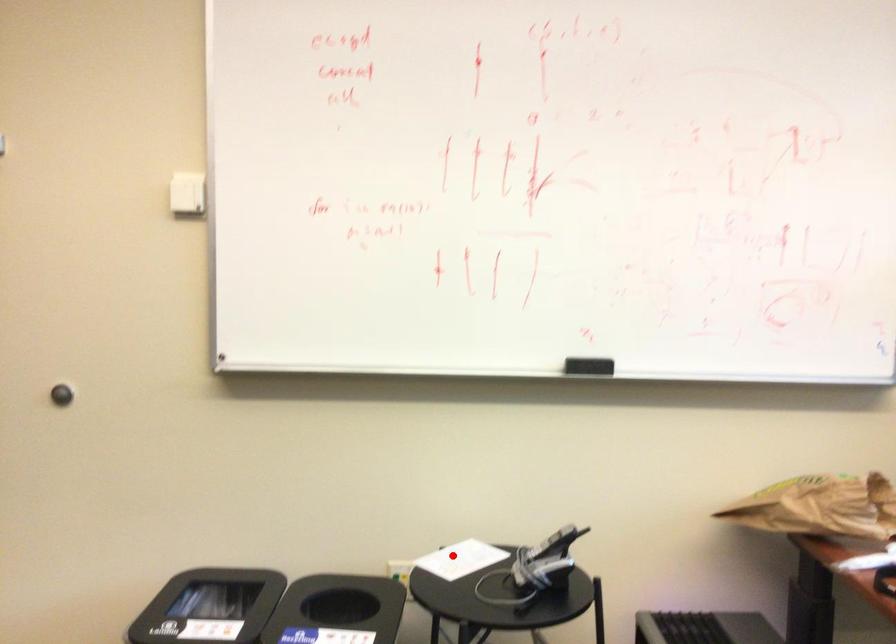
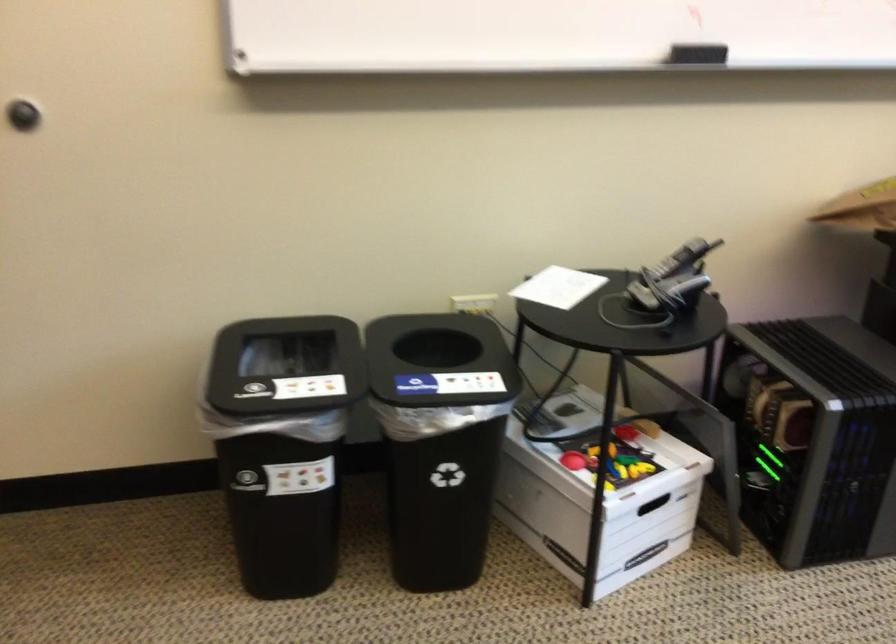
In the second image, find the point that corresponds to the highlighted location in the first image.

(558, 287)